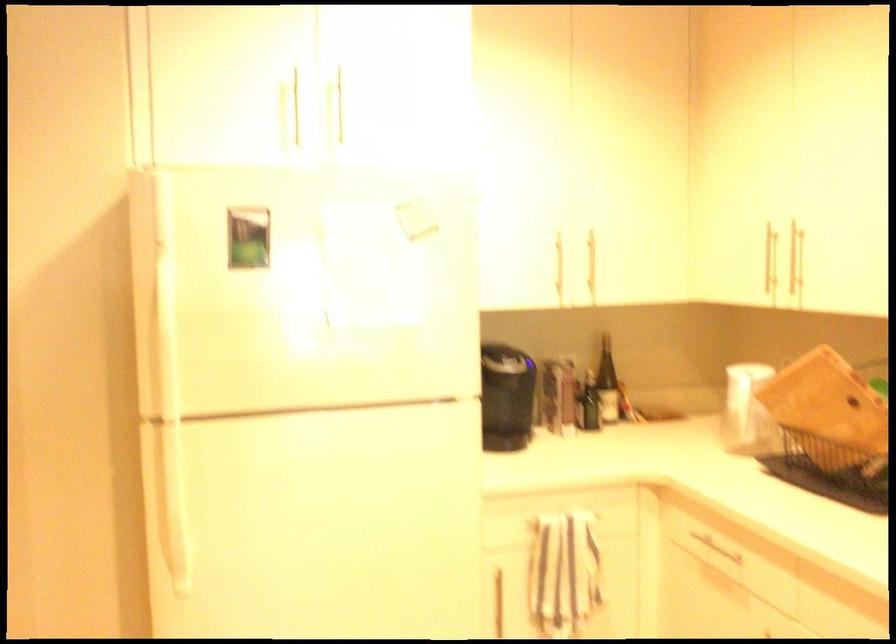
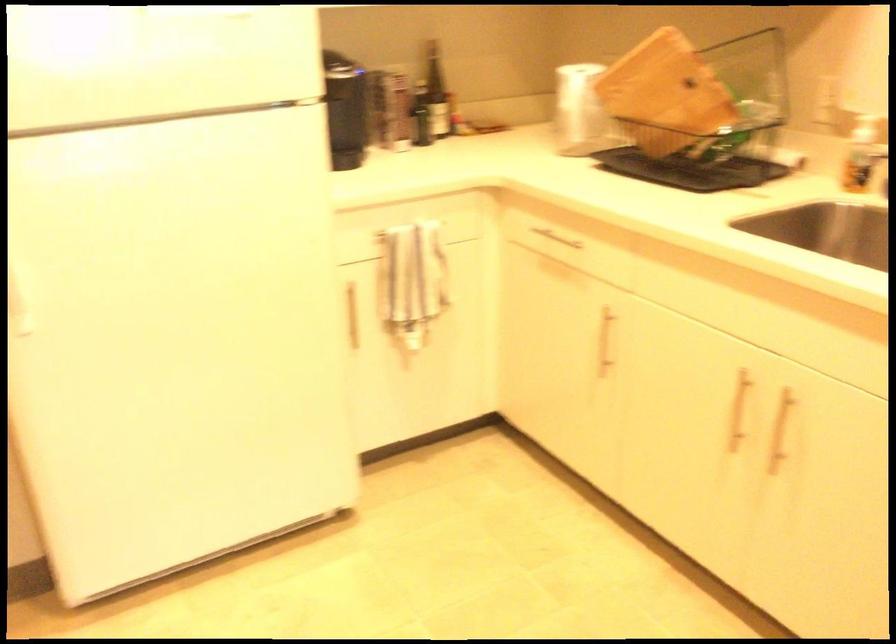
Locate, in the second image, the point that corresponds to the point at 609,379 in the first image.

(435, 91)